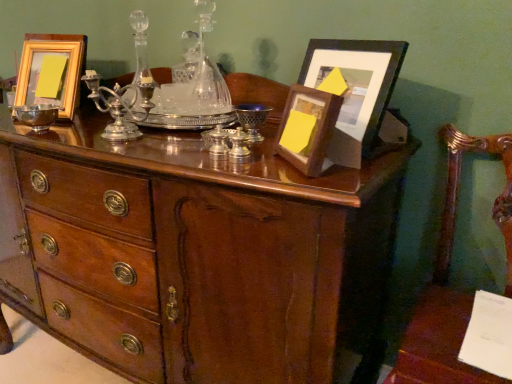
Where is `free location in front of silver polished candle holder at center, acting as the 1th candle holder starting from the left`? The width and height of the screenshot is (512, 384). free location in front of silver polished candle holder at center, acting as the 1th candle holder starting from the left is located at coordinates (121, 148).